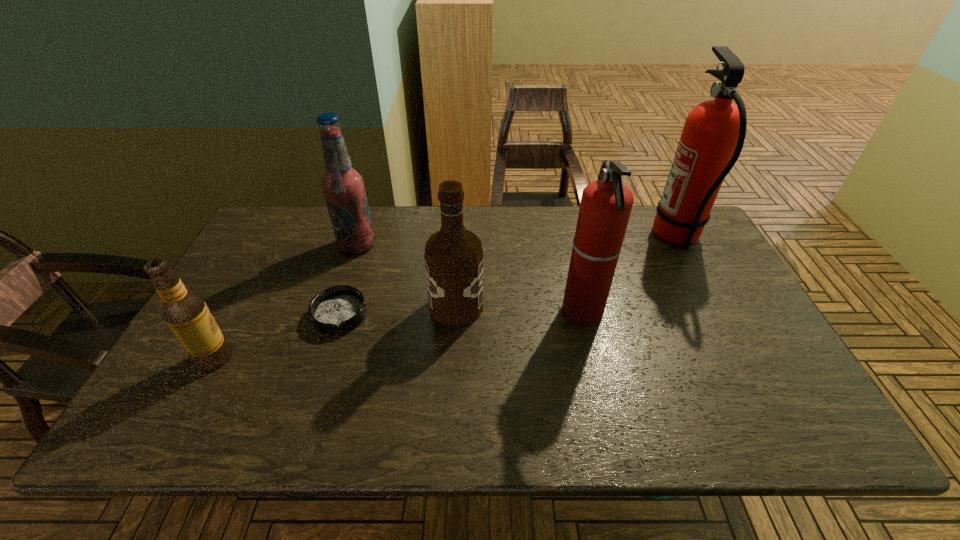
I want to click on fire extinguisher that is at the far edge, so click(x=712, y=139).

In order to click on alcohol present at the far edge in this screenshot , I will do `click(343, 187)`.

Where is `object positioned at the left edge`? This screenshot has width=960, height=540. object positioned at the left edge is located at coordinates pos(184,310).

This screenshot has height=540, width=960. What are the coordinates of `object located in the right edge section of the desktop` in the screenshot? It's located at (712, 139).

Find the location of a particular element. This screenshot has width=960, height=540. object that is at the far right corner is located at coordinates (712, 139).

The height and width of the screenshot is (540, 960). In the image, there is a desktop. Find the location of `vacant space at the far edge`. vacant space at the far edge is located at coordinates (547, 227).

In the image, there is a desktop. Where is `free space at the near edge`? The height and width of the screenshot is (540, 960). free space at the near edge is located at coordinates (730, 430).

In the image, there is a desktop. What are the coordinates of `vacant space at the left edge` in the screenshot? It's located at (196, 400).

Locate an element on the screen. The height and width of the screenshot is (540, 960). vacant area at the right edge of the desktop is located at coordinates coord(671,254).

Where is `free space at the near left corner of the desktop`? The width and height of the screenshot is (960, 540). free space at the near left corner of the desktop is located at coordinates (202, 425).